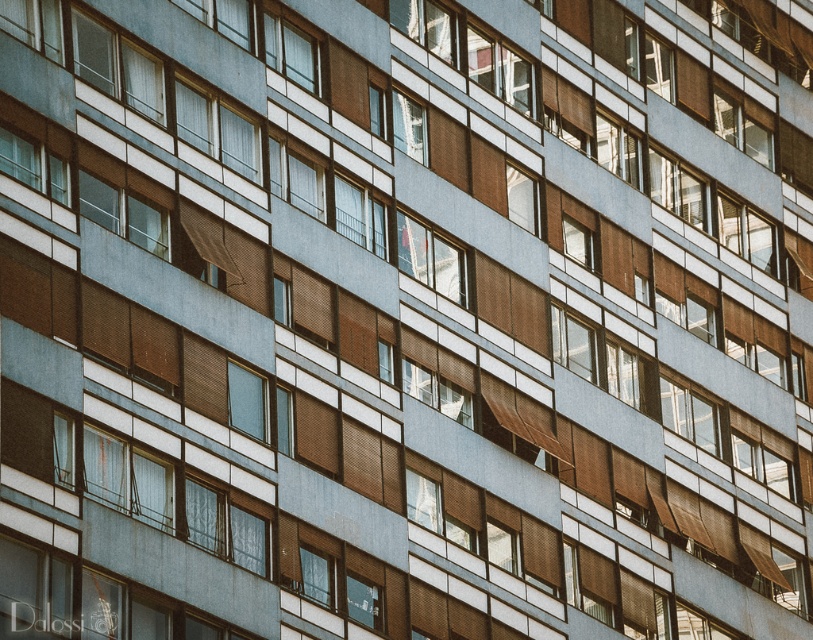
Question: Can you confirm if matte glass window at center is positioned to the right of transparent glass window at center?

Choices:
 (A) yes
 (B) no

Answer: (B)

Question: In this image, where is matte glass window at center located relative to transparent glass window at center?

Choices:
 (A) below
 (B) above

Answer: (A)

Question: Which of the following is the farthest from the observer?

Choices:
 (A) (562, 230)
 (B) (320, 563)
 (C) (303, 45)

Answer: (A)

Question: Which point is farther to the camera?

Choices:
 (A) (587, 243)
 (B) (303, 593)
 (C) (294, 42)

Answer: (A)

Question: Among these objects, which one is nearest to the camera?

Choices:
 (A) matte glass window at center
 (B) clear glass window at upper center
 (C) transparent glass window at center

Answer: (A)

Question: Observing the image, what is the correct spatial positioning of matte glass window at center in reference to transparent glass window at center?

Choices:
 (A) above
 (B) below

Answer: (B)